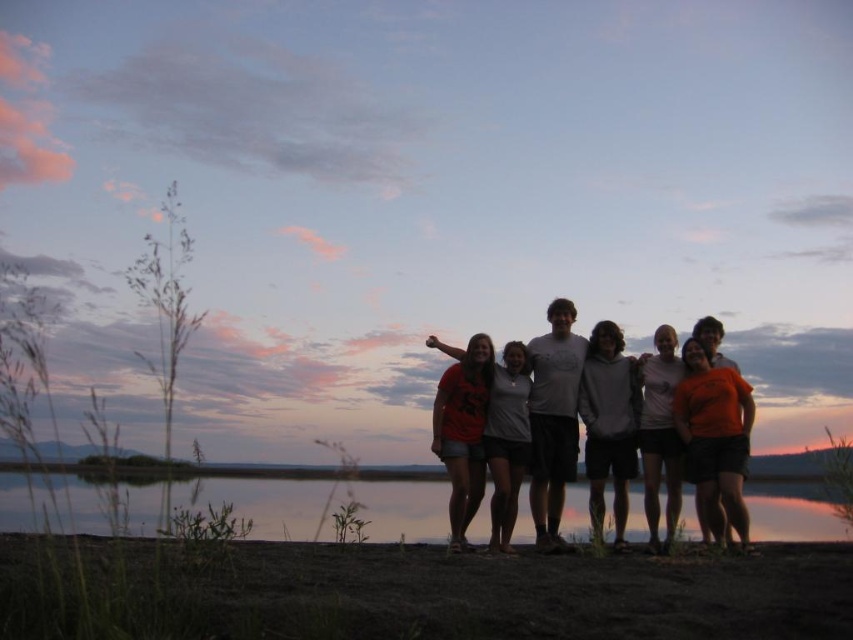
You are part of a photography team setting up a group shot. You notice two individuals in the group wearing a matte orange shirt at center and a gray hoodie at center. Which of these two clothing items appears smaller in the photo?

The matte orange shirt at center has a smaller size compared to the gray hoodie at center, so the matte orange shirt at center appears smaller in the photo.